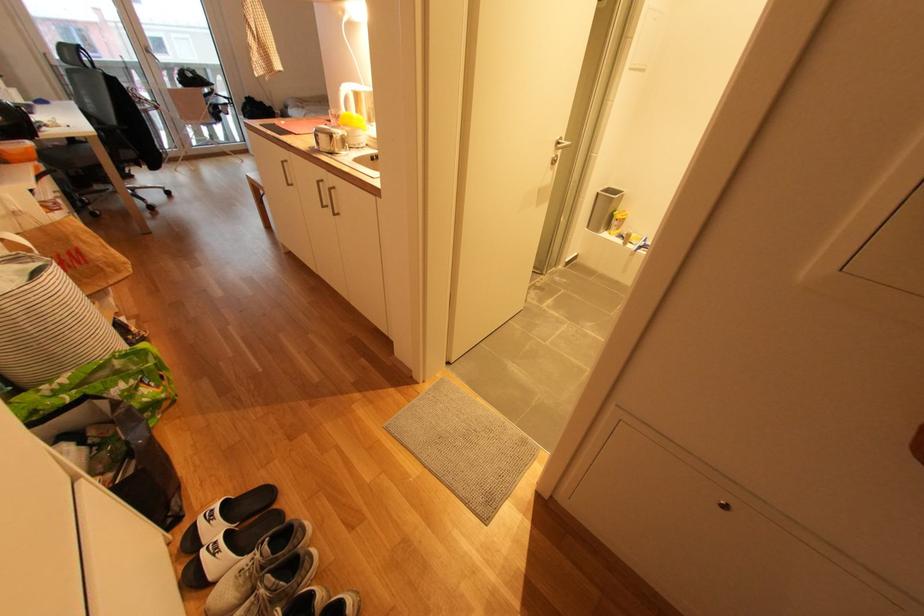
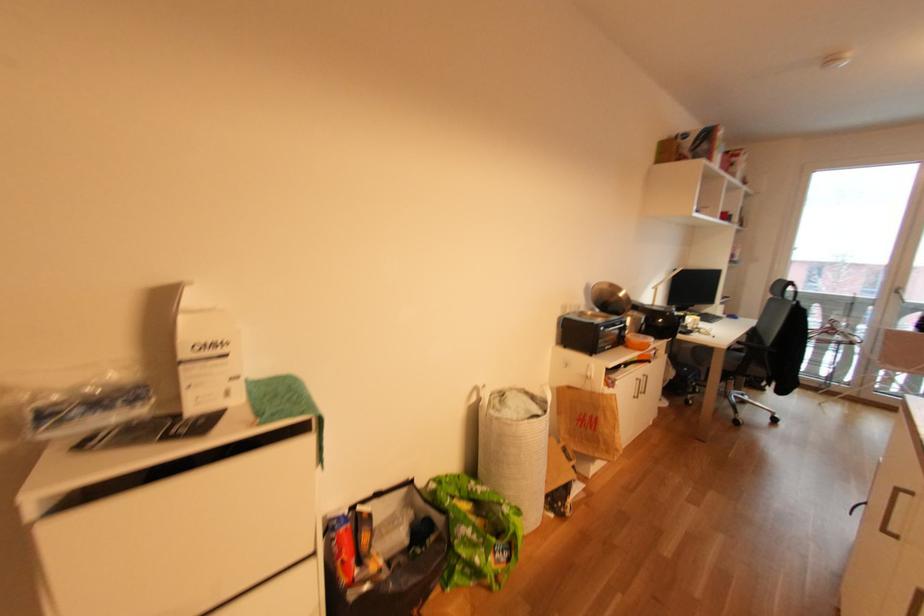
Question: The images are taken continuously from a first-person perspective. In which direction is your viewpoint rotating?

Choices:
 (A) Left
 (B) Right
 (C) Up
 (D) Down

Answer: (A)